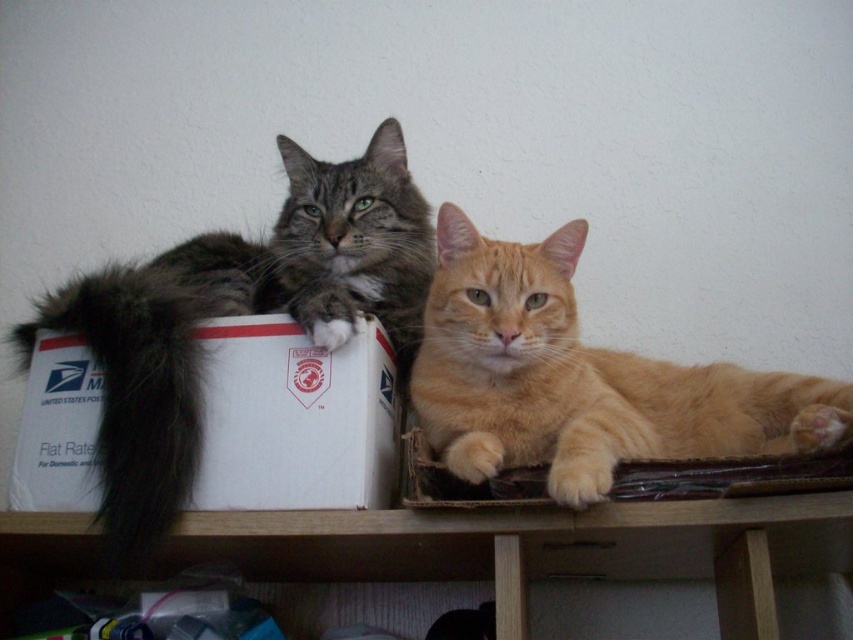
Question: In this image, where is gray fluffy cat at left located relative to dark brown fur tail at left?

Choices:
 (A) right
 (B) left

Answer: (A)

Question: Estimate the real-world distances between objects in this image. Which object is farther from the dark brown fur tail at left?

Choices:
 (A) wooden shelf at lower center
 (B) white cardboard box at left

Answer: (A)

Question: Is orange fur cat at center above wooden shelf at lower center?

Choices:
 (A) yes
 (B) no

Answer: (A)

Question: Which point appears farthest from the camera in this image?

Choices:
 (A) (421, 536)
 (B) (521, 406)

Answer: (B)

Question: Considering the relative positions of gray fluffy cat at left and orange fur cat at center in the image provided, where is gray fluffy cat at left located with respect to orange fur cat at center?

Choices:
 (A) right
 (B) left

Answer: (B)

Question: Which is farther from the dark brown fur tail at left?

Choices:
 (A) wooden shelf at lower center
 (B) gray fluffy cat at left

Answer: (A)